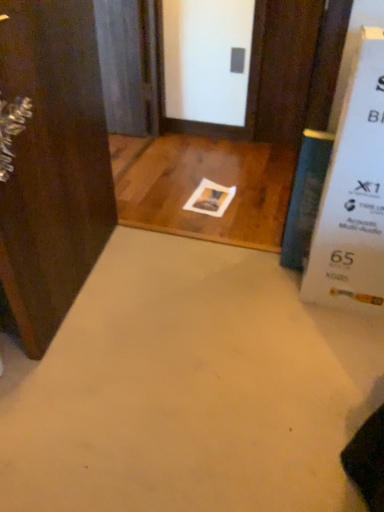
Question: Is blue glass screen door at upper left not inside dark wood door at left, acting as the 1th door starting from the front?

Choices:
 (A) yes
 (B) no

Answer: (A)

Question: Considering the relative sizes of blue glass screen door at upper left and dark wood door at left, marked as the second door in a right-to-left arrangement, in the image provided, is blue glass screen door at upper left shorter than dark wood door at left, marked as the second door in a right-to-left arrangement,?

Choices:
 (A) no
 (B) yes

Answer: (B)

Question: Does blue glass screen door at upper left appear on the left side of dark wood door at left, acting as the 1th door starting from the front?

Choices:
 (A) no
 (B) yes

Answer: (A)

Question: Could you tell me if blue glass screen door at upper left is facing dark wood door at left, acting as the 1th door starting from the front?

Choices:
 (A) no
 (B) yes

Answer: (B)

Question: Can you confirm if blue glass screen door at upper left is wider than dark wood door at left, acting as the 1th door starting from the front?

Choices:
 (A) no
 (B) yes

Answer: (A)

Question: From the image's perspective, would you say blue glass screen door at upper left is shown under dark wood door at left, which appears as the first door when viewed from the left?

Choices:
 (A) yes
 (B) no

Answer: (B)

Question: Considering the relative positions of blue glass screen door at upper left and brown wood door at upper center, which is the 1th door in right-to-left order, in the image provided, is blue glass screen door at upper left behind brown wood door at upper center, which is the 1th door in right-to-left order,?

Choices:
 (A) no
 (B) yes

Answer: (B)

Question: Considering the relative sizes of blue glass screen door at upper left and brown wood door at upper center, which appears as the first door when viewed from the back, in the image provided, is blue glass screen door at upper left smaller than brown wood door at upper center, which appears as the first door when viewed from the back,?

Choices:
 (A) yes
 (B) no

Answer: (B)

Question: Considering the relative sizes of blue glass screen door at upper left and brown wood door at upper center, acting as the first door starting from the top, in the image provided, is blue glass screen door at upper left wider than brown wood door at upper center, acting as the first door starting from the top,?

Choices:
 (A) no
 (B) yes

Answer: (B)

Question: Does blue glass screen door at upper left have a lesser width compared to brown wood door at upper center, the second door positioned from the left?

Choices:
 (A) yes
 (B) no

Answer: (B)

Question: Can you confirm if blue glass screen door at upper left is positioned to the left of brown wood door at upper center, acting as the first door starting from the top?

Choices:
 (A) yes
 (B) no

Answer: (A)

Question: From a real-world perspective, is blue glass screen door at upper left positioned under brown wood door at upper center, the second door positioned from the left, based on gravity?

Choices:
 (A) no
 (B) yes

Answer: (B)

Question: Does dark wood door at left, which appears as the first door when viewed from the left, have a larger size compared to blue glass screen door at upper left?

Choices:
 (A) yes
 (B) no

Answer: (A)